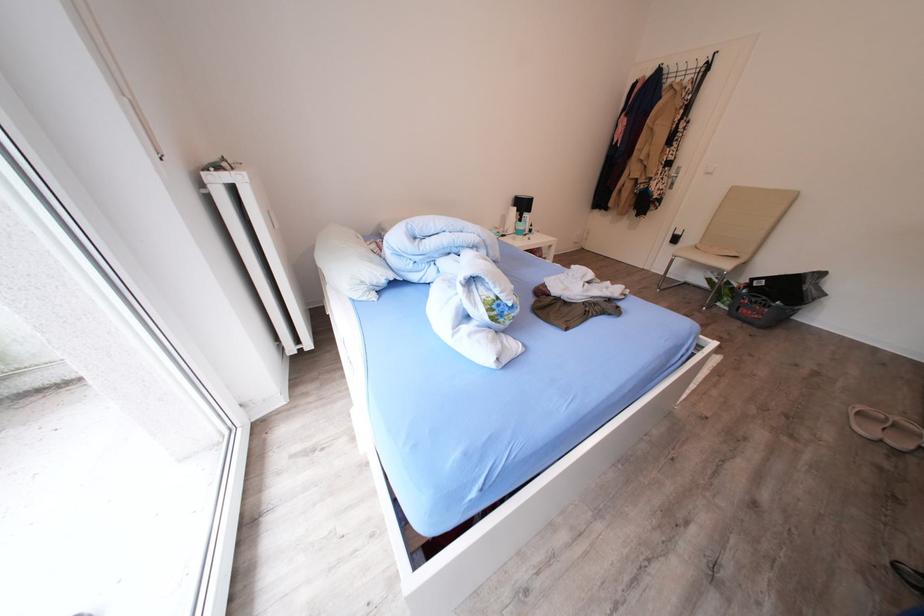
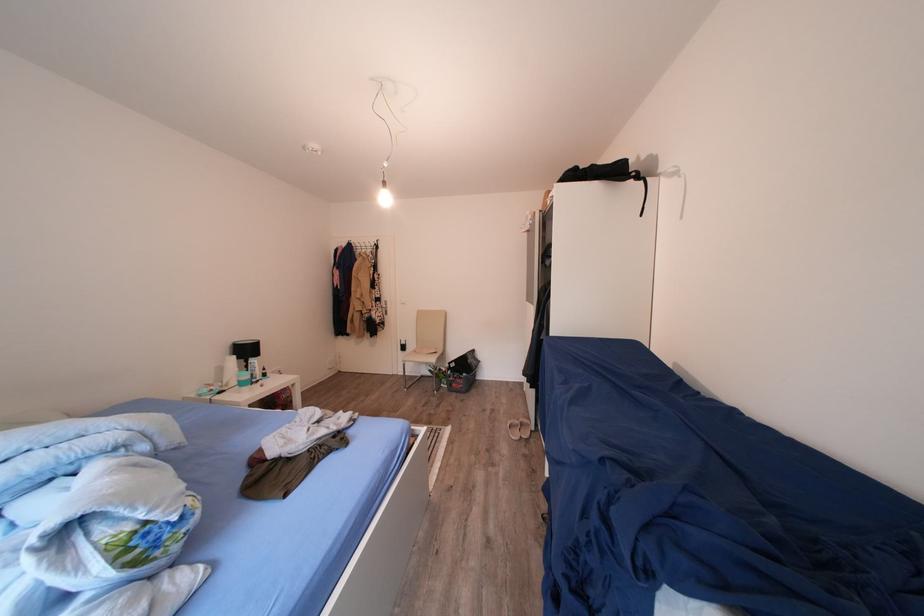
The point at (529, 225) is marked in the first image. Where is the corresponding point in the second image?

(256, 371)